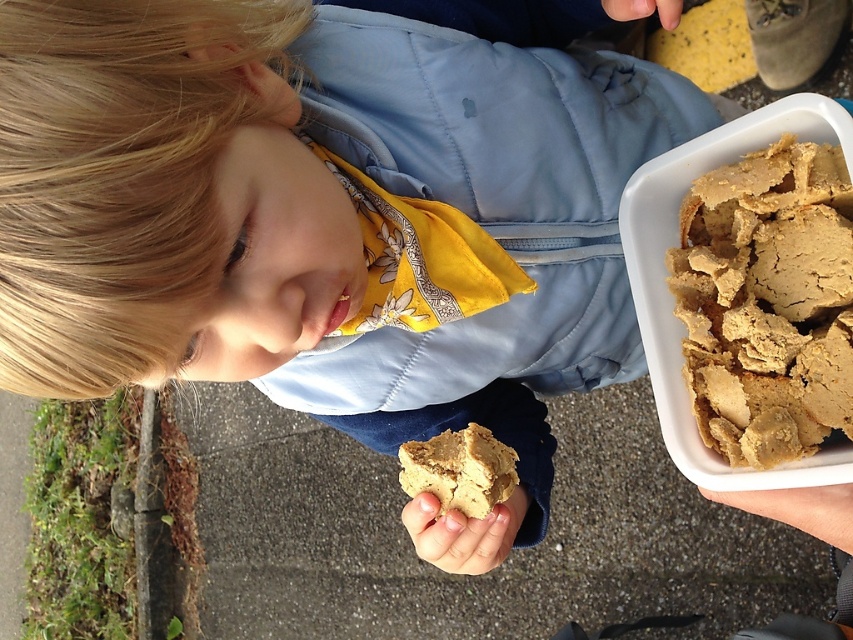
Question: Can you confirm if smooth beige cookie at lower center is bigger than smooth skin hand at lower right?

Choices:
 (A) yes
 (B) no

Answer: (A)

Question: Does brown crumbly cookie at upper right appear under smooth beige cookie at lower center?

Choices:
 (A) no
 (B) yes

Answer: (A)

Question: Which object appears closest to the camera in this image?

Choices:
 (A) smooth beige cookie at lower center
 (B) smooth skin hand at lower right
 (C) golden crumbly cookie at lower center
 (D) brown crumbly cookie at upper right

Answer: (B)

Question: Which point is farther to the camera?

Choices:
 (A) (412, 461)
 (B) (798, 506)
 (C) (418, 500)
 (D) (779, 316)

Answer: (A)

Question: Which point appears closest to the camera in this image?

Choices:
 (A) (808, 531)
 (B) (425, 547)
 (C) (751, 195)
 (D) (486, 499)

Answer: (A)

Question: Is brown crumbly cookie at upper right closer to camera compared to smooth skin hand at lower right?

Choices:
 (A) no
 (B) yes

Answer: (A)